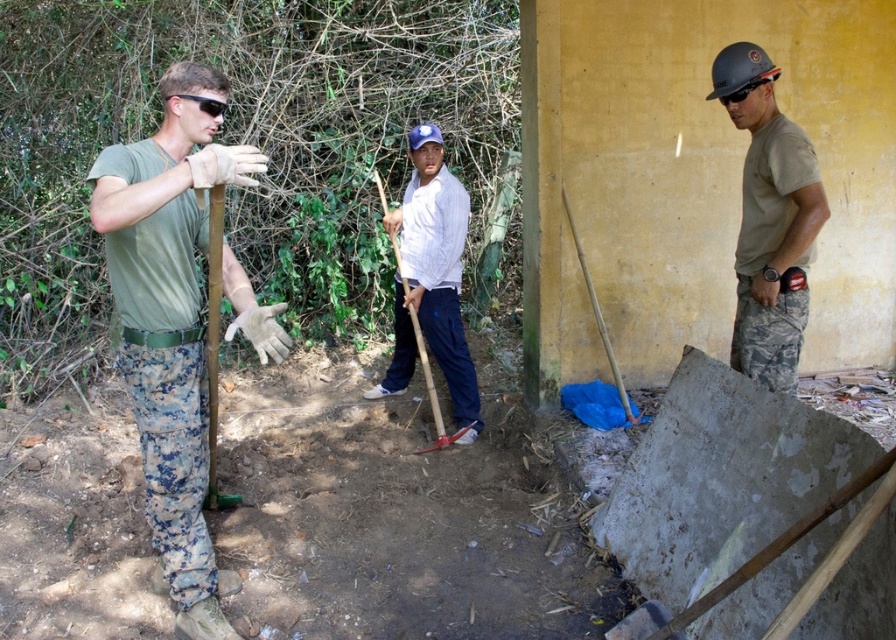
Does point (162, 348) lie behind point (784, 196)?

No, (162, 348) is in front of (784, 196).

Is camouflage pants at center above camouflage pants at right?

No.

Measure the distance between point (x=240, y=164) and camera.

2.61 meters

Image resolution: width=896 pixels, height=640 pixels. In order to click on camouflage pants at center in this screenshot , I will do `click(170, 320)`.

Is point (733, 116) less distant than point (378, 180)?

Yes, it is.

Which is more to the left, camouflage pants at right or wooden shovel at center?

Positioned to the left is wooden shovel at center.

Is point (760, 232) in front of point (403, 289)?

Yes, point (760, 232) is in front of point (403, 289).

This screenshot has width=896, height=640. Find the location of `camouflage pants at right`. camouflage pants at right is located at coordinates (768, 218).

How distant is smooth concrete slab at lower right from camouflage pants at center?

5.84 feet

Looking at this image, is smooth concrete slab at lower right positioned in front of camouflage pants at center?

Yes.

In order to click on smooth concrete slab at lower right in this screenshot , I will do `click(721, 477)`.